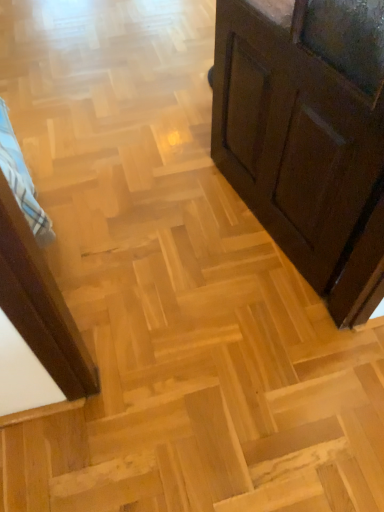
Locate an element on the screen. The height and width of the screenshot is (512, 384). dark wood door at right is located at coordinates (308, 136).

What is the approximate height of dark wood door at right?

It is 86.57 centimeters.

The image size is (384, 512). Describe the element at coordinates (308, 136) in the screenshot. I see `dark wood door at right` at that location.

What is the approximate width of dark wood door at right?

The width of dark wood door at right is 4.88 inches.

At what (x,y) coordinates should I click in order to perform the action: click on dark wood door at right. Please return your answer as a coordinate pair (x, y). This screenshot has width=384, height=512. Looking at the image, I should click on (308, 136).